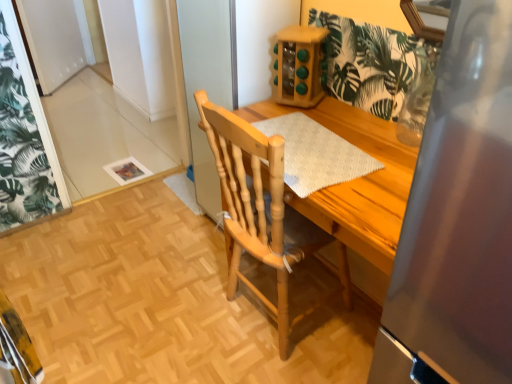
The height and width of the screenshot is (384, 512). In order to click on free spot to the left of natural wood chair at center in this screenshot , I will do `click(178, 311)`.